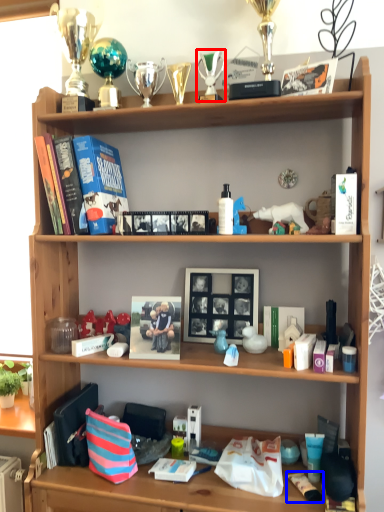
Question: Which object is closer to the camera taking this photo, toy (highlighted by a red box) or toiletry (highlighted by a blue box)?

Choices:
 (A) toy
 (B) toiletry

Answer: (B)